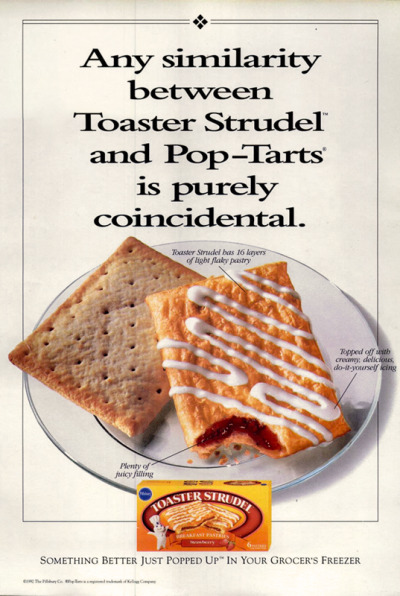
Where is `toaster strudel  crumbs`? The width and height of the screenshot is (400, 596). toaster strudel  crumbs is located at coordinates (222, 462), (237, 446), (247, 453), (256, 456), (236, 461), (228, 450), (218, 454), (186, 461).